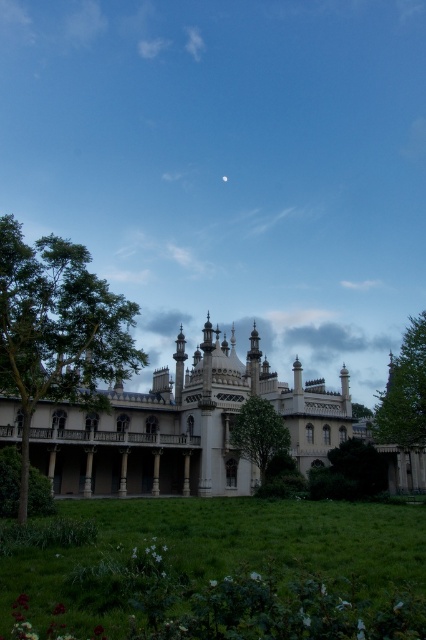
Is point (210, 346) less distant than point (262, 458)?

No, it is not.

Between point (132, 404) and point (232, 440), which one is positioned in front?

Positioned in front is point (232, 440).

The height and width of the screenshot is (640, 426). Find the location of `white stone palace at center`. white stone palace at center is located at coordinates (186, 426).

Is point (118, 392) positioned after point (399, 470)?

No, it is in front of (399, 470).

Can you confirm if white stone palace at center is thinner than green leafy tree at right?

In fact, white stone palace at center might be wider than green leafy tree at right.

Does point (186, 358) come closer to viewer compared to point (376, 410)?

Yes, it is.

Identify the location of white stone palace at center. coord(186,426).

Can you confirm if green leafy tree at left is wider than green leafy tree at lower center?

Indeed, green leafy tree at left has a greater width compared to green leafy tree at lower center.

From the picture: Who is more forward, (x=100, y=330) or (x=368, y=492)?

Positioned in front is point (x=100, y=330).

Locate an element on the screen. This screenshot has width=426, height=640. green leafy tree at left is located at coordinates (57, 330).